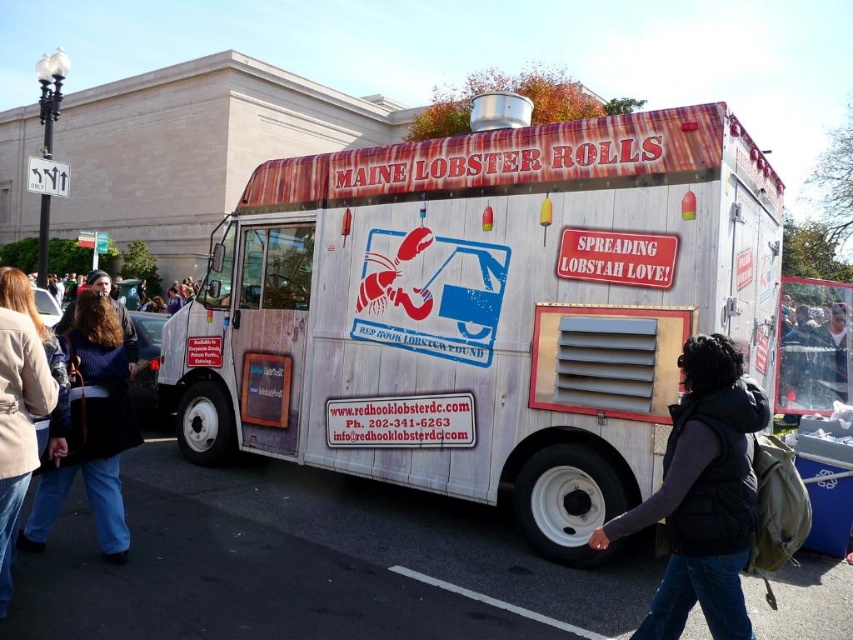
Based on the photo, does wooden food truck at center have a larger size compared to blue denim jeans at lower left?

No, wooden food truck at center is not bigger than blue denim jeans at lower left.

Who is taller, wooden food truck at center or blue denim jeans at lower left?

blue denim jeans at lower left

Is point (744, 326) farther from viewer compared to point (103, 387)?

Yes, it is behind point (103, 387).

What are the coordinates of `wooden food truck at center` in the screenshot? It's located at (480, 310).

Is point (672, 636) more distant than point (73, 467)?

No, (672, 636) is closer to viewer.

Between point (698, 394) and point (83, 464), which one is positioned behind?

Positioned behind is point (83, 464).

Which is in front, point (741, 636) or point (115, 352)?

Point (741, 636)

Identify the location of black puffer vest at lower right. (701, 496).

Can you confirm if wooden food truck at center is positioned above beige leather jacket at lower left?

Actually, wooden food truck at center is below beige leather jacket at lower left.

Is wooden food truck at center bigger than beige leather jacket at lower left?

Correct, wooden food truck at center is larger in size than beige leather jacket at lower left.

Describe the element at coordinates (480, 310) in the screenshot. The width and height of the screenshot is (853, 640). I see `wooden food truck at center` at that location.

Image resolution: width=853 pixels, height=640 pixels. I want to click on wooden food truck at center, so click(x=480, y=310).